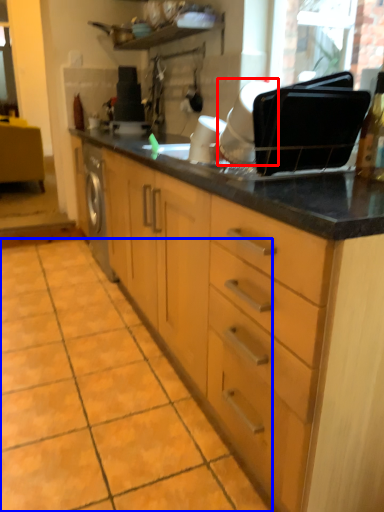
Question: Which of the following is the farthest to the observer, appliance (highlighted by a red box) or ceramic tile (highlighted by a blue box)?

Choices:
 (A) appliance
 (B) ceramic tile

Answer: (A)